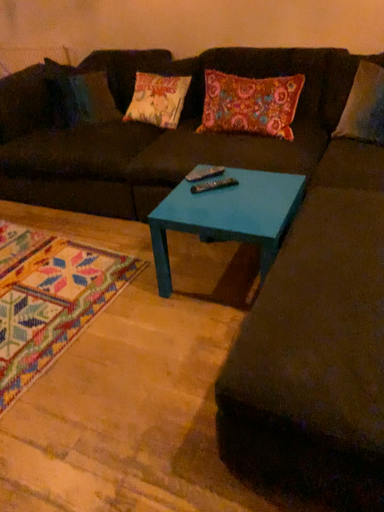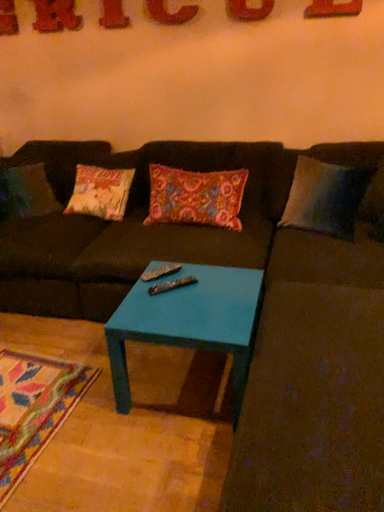
Question: How did the camera likely rotate when shooting the video?

Choices:
 (A) rotated downward
 (B) rotated upward

Answer: (B)